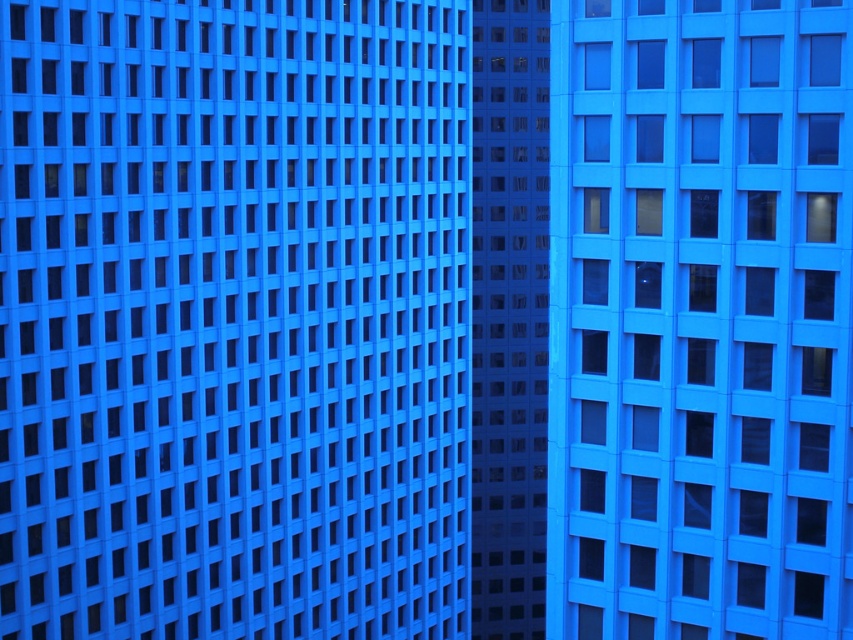
Question: Can you confirm if matte glass windows at right is positioned to the left of transparent glass windows at center?

Choices:
 (A) yes
 (B) no

Answer: (B)

Question: Is matte glass windows at right to the right of transparent glass windows at center from the viewer's perspective?

Choices:
 (A) no
 (B) yes

Answer: (B)

Question: Does matte glass windows at right appear on the right side of transparent glass windows at center?

Choices:
 (A) no
 (B) yes

Answer: (B)